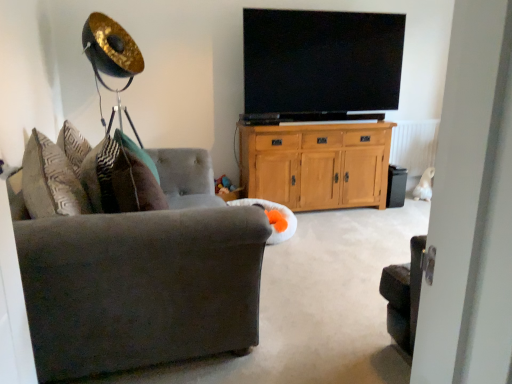
I want to click on vacant space to the right of white soft bean bag at center, so click(x=333, y=242).